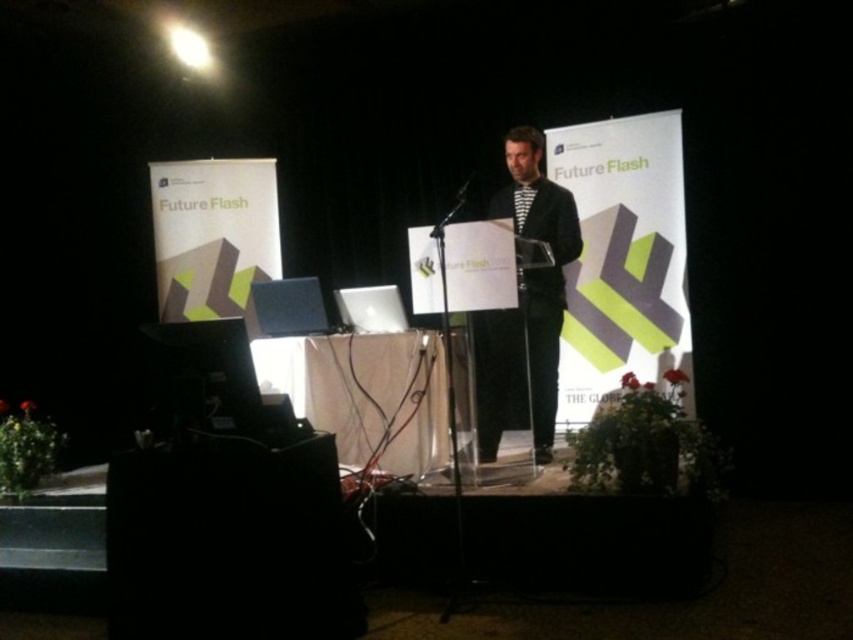
You are an attendee at the Future Flash event and want to take a photo of the speaker. The speaker is wearing a striped fabric shirt at center and holding a transparent plastic microphone at center. Which object should you focus on first to ensure both are in the frame?

You should focus on the striped fabric shirt at center first since it is closer to the viewer than the transparent plastic microphone at center, ensuring both are in the frame.

You are an event organizer who needs to place a new decorative item between the black plastic speaker at lower left and the transparent plastic microphone at center. Considering their sizes, which object should the new item be placed closer to?

The black plastic speaker at lower left is larger than the transparent plastic microphone at center, so the new decorative item should be placed closer to the transparent plastic microphone at center to balance the size difference.

You are an event organizer who needs to adjust the stage layout. The black plastic speaker at lower left and the striped fabric shirt at center are currently in specific positions. To ensure the presenter can move freely, which object should be moved closer to the right side?

The black plastic speaker at lower left should be moved closer to the right side because it is currently positioned on the left side of the striped fabric shirt at center, so shifting it right would create more space for the presenter to move around.